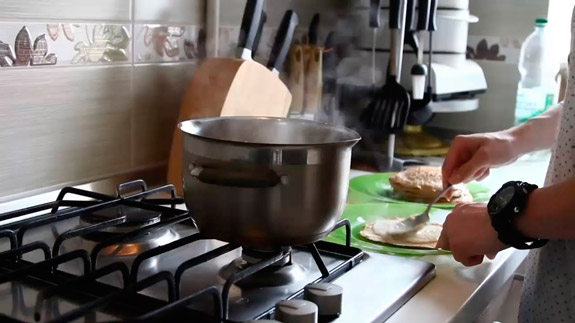
Identify the location of knives. (281, 46), (248, 32), (264, 17).